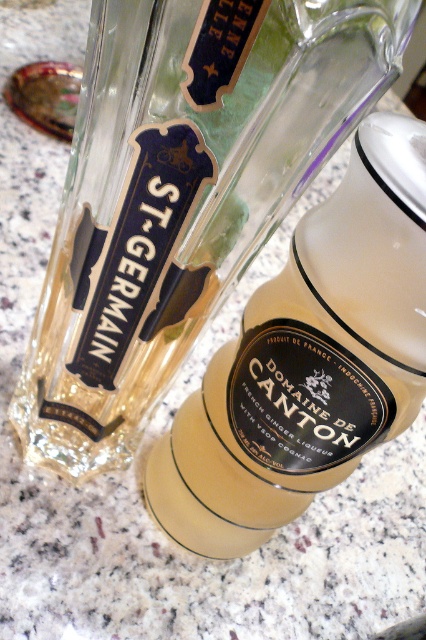
You are a bartender preparing a drink and need to place a 3.5 inch wide ice cube between the clear glass bottle at center and the translucent glass bottle at center. Can you fit the ice cube between them without moving either bottle?

The clear glass bottle at center and the translucent glass bottle at center are 3.46 inches apart from each other. Since the ice cube is 3.5 inches wide, it cannot fit between them as the space is slightly narrower than the ice cube.

You are a bartender preparing a drink that requires pouring the contents of the clear glass bottle at center into the translucent glass bottle at center. Can you do this without spilling, considering their positions?

The clear glass bottle at center is located above the translucent glass bottle at center, so you can pour the contents from the clear glass bottle at center into the translucent glass bottle at center without spilling as long as you carefully control the pouring motion.